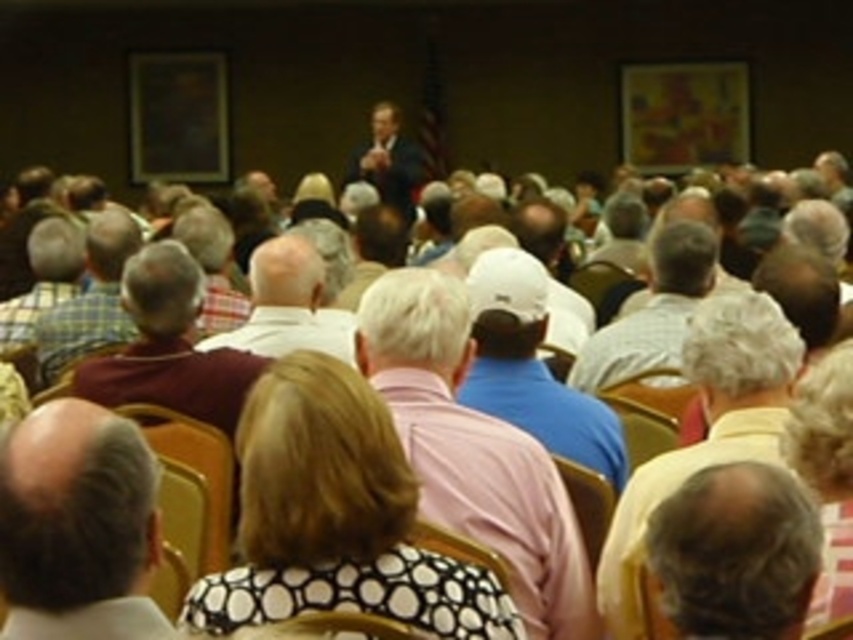
You are an attendee in the audience looking at the speaker. Which of the two, the light brown shirt at center or the dark suit at center, is closer to your line of sight?

The light brown shirt at center is below the dark suit at center, so the dark suit at center is closer to your line of sight.

Consider the image. You are an attendee sitting at the back of the room. You notice two people in the front row wearing a polka dot shirt at center and a light brown shirt at center. From your perspective, which one is positioned to the right?

The polka dot shirt at center is to the right of the light brown shirt at center.

You are an event planner trying to arrange a photo shoot for the event. You need to place a large backdrop behind the speaker. The backdrop will cover the area where the polka dot shirt at center and light brown shirt at center are located. Which shirt will be more visible behind the backdrop?

The polka dot shirt at center is smaller than the light brown shirt at center, so the light brown shirt at center will be more visible behind the backdrop.